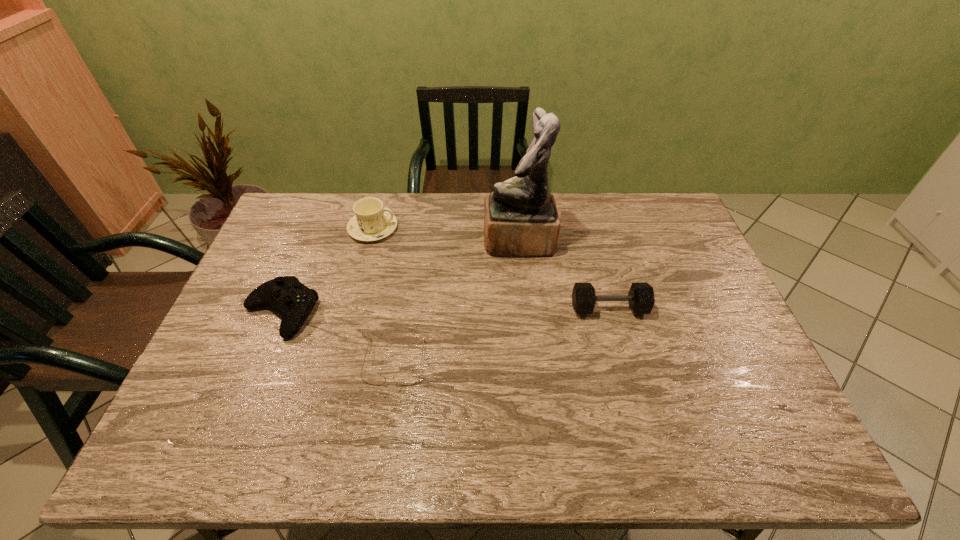
The width and height of the screenshot is (960, 540). I want to click on free space that satisfies the following two spatial constraints: 1. in a relaxed pose on the fourth object from left to right; 2. on the front-facing side of the shortest object, so click(x=530, y=362).